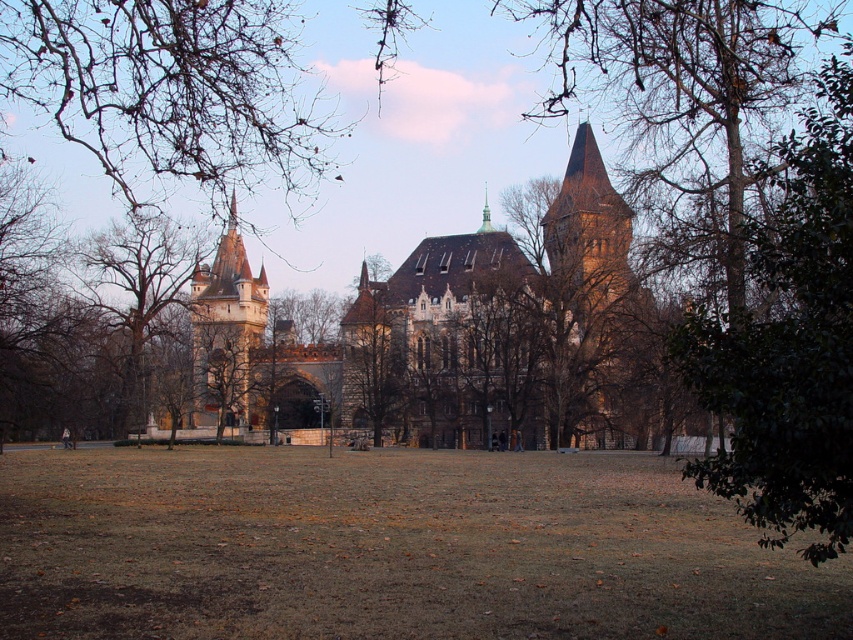
You are standing in the park area of the castle grounds and see the brown leafless tree at left and the smooth gold spire at upper center. Which object is located to the left of the other?

The brown leafless tree at left is positioned on the left side of smooth gold spire at upper center, so the brown leafless tree at left is to the left of the smooth gold spire at upper center.

You are standing in the park area in front of the castle. You see a brown leafless tree at left and a smooth gold spire at upper center. Which object is higher up in the image?

The smooth gold spire at upper center is higher up in the image than the brown leafless tree at left.

You are standing in the park in front of the castle and want to walk directly towards the brown stone tower at center. Which direction should you walk relative to the brown stone church at center?

You should walk to the right of the brown stone church at center because the brown stone tower at center is to the right of the brown stone church at center.